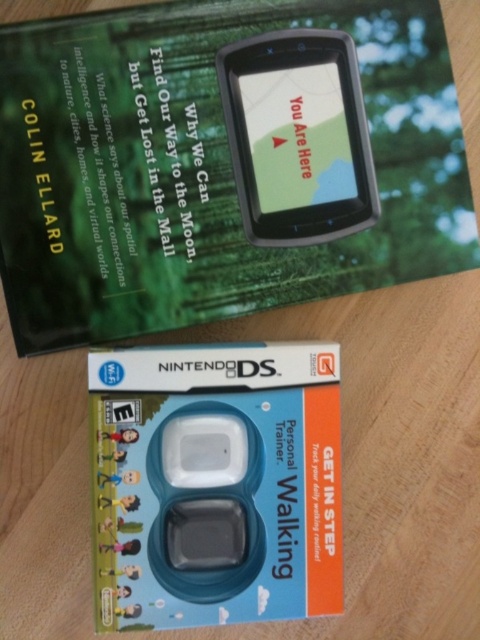
The image size is (480, 640). Identify the location of blue plastic nintendo ds at center. (215, 483).

How far apart are blue plastic nintendo ds at center and black plastic gps at upper center?

They are 38.59 centimeters apart.

What do you see at coordinates (215, 483) in the screenshot?
I see `blue plastic nintendo ds at center` at bounding box center [215, 483].

Where is `blue plastic nintendo ds at center`? The width and height of the screenshot is (480, 640). blue plastic nintendo ds at center is located at coordinates pyautogui.click(x=215, y=483).